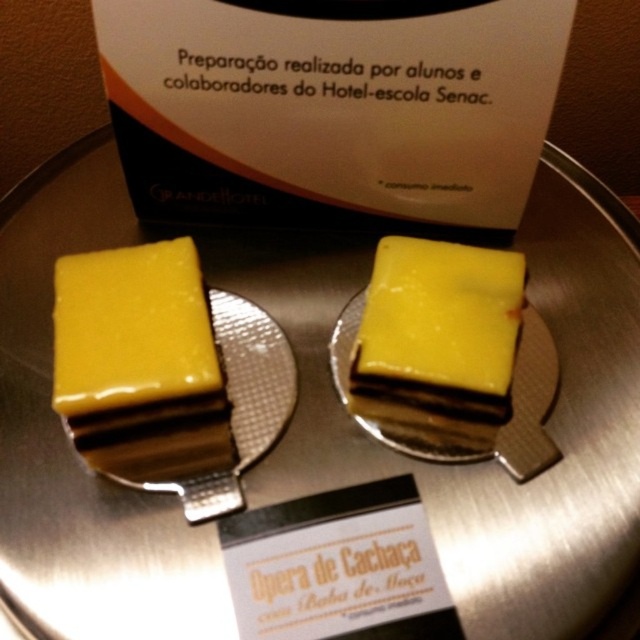
Between yellow glossy cake at left and yellow glossy cake at center, which one has more height?

yellow glossy cake at left

Does point (108, 381) come farther from viewer compared to point (394, 264)?

No, (108, 381) is closer to viewer.

Where is `yellow glossy cake at left`? yellow glossy cake at left is located at coordinates (138, 362).